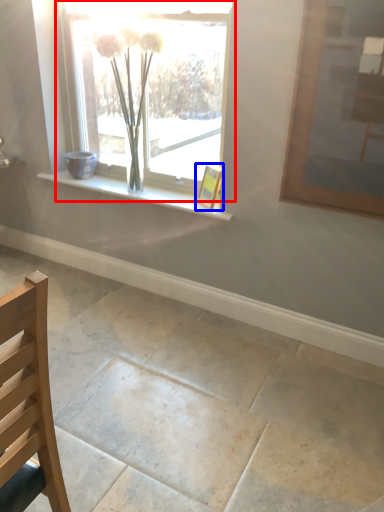
Question: Which of the following is the farthest to the observer, window (highlighted by a red box) or picture frame (highlighted by a blue box)?

Choices:
 (A) window
 (B) picture frame

Answer: (B)